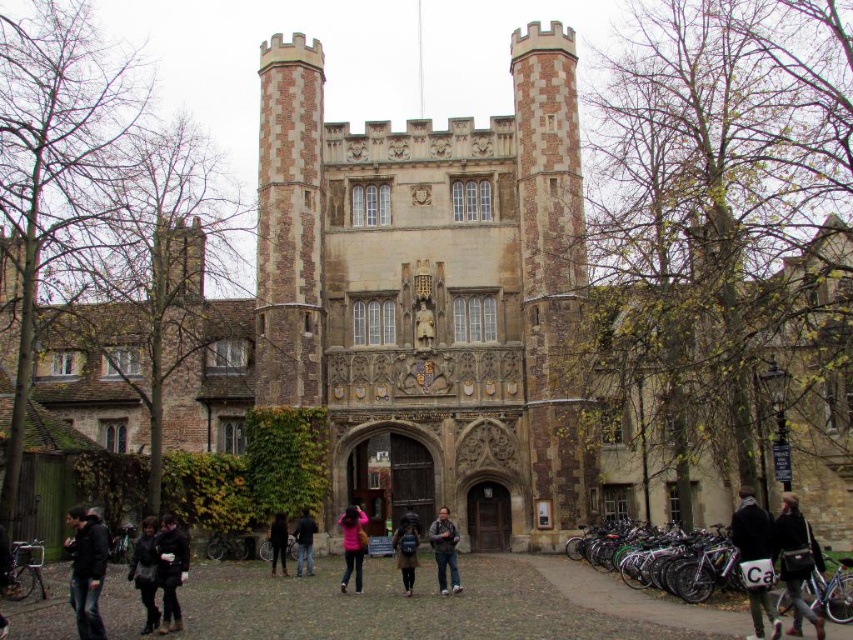
Can you confirm if brown fuzzy coat at center is thinner than black leather jacket at center?

No, brown fuzzy coat at center is not thinner than black leather jacket at center.

Who is higher up, brown fuzzy coat at center or black leather jacket at center?

black leather jacket at center

Based on the photo, measure the distance between brown fuzzy coat at center and camera.

66.73 meters

In order to click on brown fuzzy coat at center in this screenshot , I will do `click(405, 548)`.

Is dark gray jeans at center behind brown fuzzy coat at center?

Yes, it is behind brown fuzzy coat at center.

Who is more forward, (x=444, y=524) or (x=408, y=531)?

Point (x=444, y=524) is in front.

Locate an element on the screen. This screenshot has width=853, height=640. dark gray jeans at center is located at coordinates (444, 550).

Locate an element on the screen. This screenshot has width=853, height=640. dark gray jeans at center is located at coordinates (444, 550).

Can you confirm if dark gray jeans at center is taller than black fabric pants at lower center?

Incorrect, dark gray jeans at center's height is not larger of black fabric pants at lower center's.

Is dark gray jeans at center bigger than black fabric pants at lower center?

No, dark gray jeans at center is not bigger than black fabric pants at lower center.

Does point (451, 522) come in front of point (281, 538)?

No, it is behind (281, 538).

The height and width of the screenshot is (640, 853). Find the location of `dark gray jeans at center`. dark gray jeans at center is located at coordinates (444, 550).